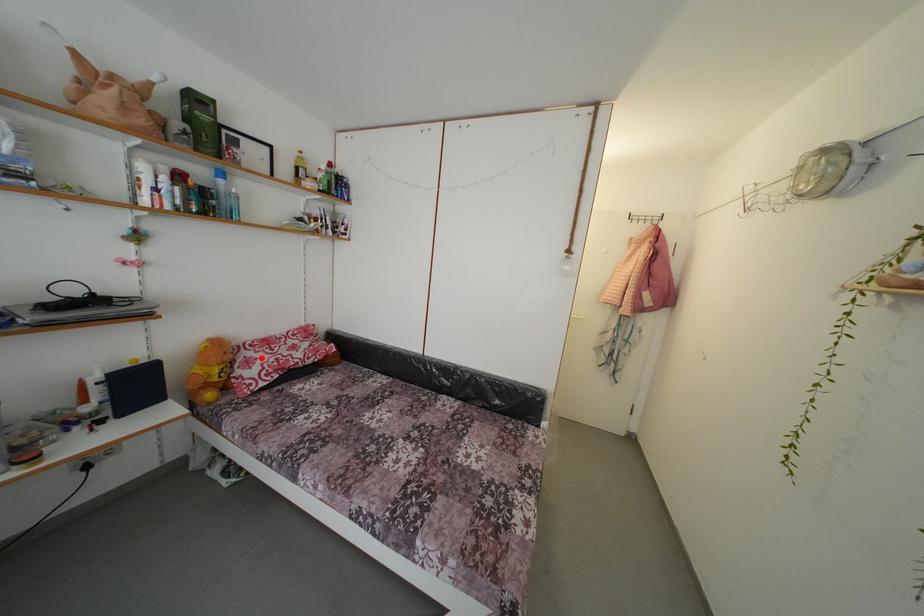
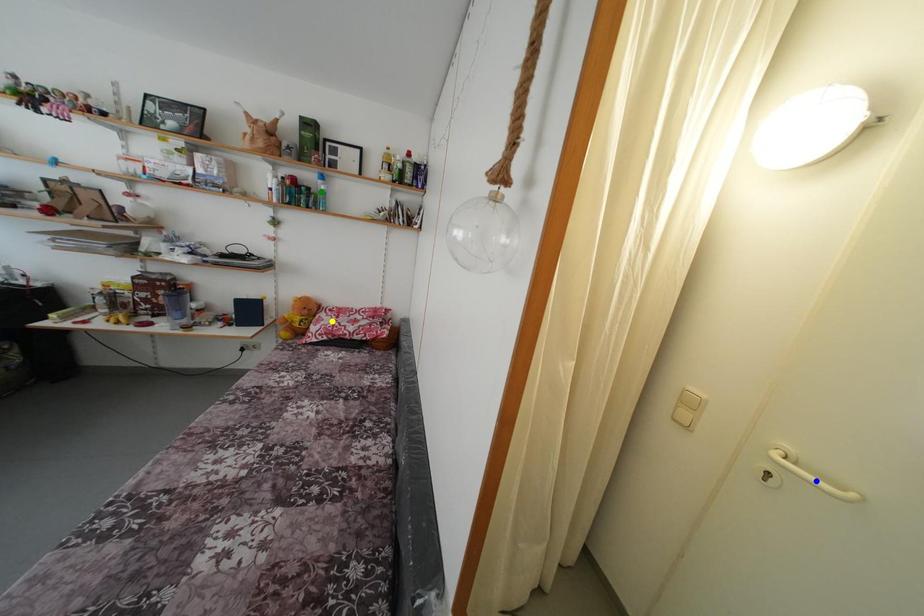
Question: I am providing you with two images of the same scene from different viewpoints. A red point is marked on the first image. You are given multiple points on the second image. Which spot in image 2 lines up with the point in image 1?

Choices:
 (A) yellow point
 (B) blue point
 (C) green point

Answer: (A)